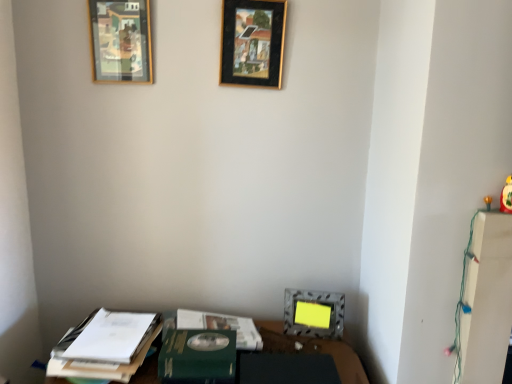
Image resolution: width=512 pixels, height=384 pixels. I want to click on yellow matte toy at right, so click(506, 196).

From the picture: What is the approximate height of metallic silver picture frame at lower center, acting as the 1th picture frame starting from the right?

7.00 inches.

Describe the element at coordinates (313, 313) in the screenshot. Image resolution: width=512 pixels, height=384 pixels. I see `metallic silver picture frame at lower center, positioned as the 3th picture frame in left-to-right order` at that location.

This screenshot has width=512, height=384. I want to click on yellow matte toy at right, so click(506, 196).

Considering the relative sizes of yellow matte toy at right and wooden frame at upper left, the first picture frame viewed from the top, in the image provided, is yellow matte toy at right thinner than wooden frame at upper left, the first picture frame viewed from the top,?

Incorrect, the width of yellow matte toy at right is not less than that of wooden frame at upper left, the first picture frame viewed from the top.

Is yellow matte toy at right to the left or to the right of wooden frame at upper left, which is the third picture frame from right to left, in the image?

yellow matte toy at right is positioned on wooden frame at upper left, which is the third picture frame from right to left,'s right side.

Can you see yellow matte toy at right touching wooden frame at upper left, the first picture frame viewed from the top?

There is a gap between yellow matte toy at right and wooden frame at upper left, the first picture frame viewed from the top.

From a real-world perspective, is yellow matte toy at right on top of wooden frame at upper left, which is the third picture frame from right to left?

No, from a real-world perspective, yellow matte toy at right is not on top of wooden frame at upper left, which is the third picture frame from right to left.

Is wooden frame at upper left, the 3th picture frame in the bottom-to-top sequence, inside the boundaries of green matte paperback book at lower center, or outside?

wooden frame at upper left, the 3th picture frame in the bottom-to-top sequence, is located beyond the bounds of green matte paperback book at lower center.

Looking at this image, in terms of width, does wooden frame at upper left, the first picture frame viewed from the top, look wider or thinner when compared to green matte paperback book at lower center?

Considering their sizes, wooden frame at upper left, the first picture frame viewed from the top, looks slimmer than green matte paperback book at lower center.

From the image's perspective, which object appears higher, wooden frame at upper left, which is the third picture frame from right to left, or green matte paperback book at lower center?

wooden frame at upper left, which is the third picture frame from right to left, appears higher in the image.

From the image's perspective, which one is positioned higher, black matte picture frame at upper center, which is the 2th picture frame in top-to-bottom order, or green matte journal at lower center?

black matte picture frame at upper center, which is the 2th picture frame in top-to-bottom order, from the image's perspective.

Is black matte picture frame at upper center, the second picture frame in the bottom-to-top sequence, facing towards green matte journal at lower center?

No, black matte picture frame at upper center, the second picture frame in the bottom-to-top sequence, is not aimed at green matte journal at lower center.

From a real-world perspective, is black matte picture frame at upper center, the second picture frame in the bottom-to-top sequence, positioned over green matte journal at lower center based on gravity?

Indeed, from a real-world perspective, black matte picture frame at upper center, the second picture frame in the bottom-to-top sequence, stands above green matte journal at lower center.

Locate an element on the screen. picture frame that is the 1st one when counting rightward from the green matte journal at lower center is located at coordinates (252, 42).

Which point is more distant from viewer, [316,328] or [261,11]?

The point [316,328] is more distant.

Are metallic silver picture frame at lower center, acting as the first picture frame starting from the bottom, and black matte picture frame at upper center, which is the 2th picture frame in top-to-bottom order, located far from each other?

No, there isn't a large distance between metallic silver picture frame at lower center, acting as the first picture frame starting from the bottom, and black matte picture frame at upper center, which is the 2th picture frame in top-to-bottom order.

From the image's perspective, does metallic silver picture frame at lower center, acting as the first picture frame starting from the bottom, appear lower than black matte picture frame at upper center, which is the 2th picture frame in top-to-bottom order?

Indeed, from the image's perspective, metallic silver picture frame at lower center, acting as the first picture frame starting from the bottom, is shown beneath black matte picture frame at upper center, which is the 2th picture frame in top-to-bottom order.

Do you think metallic silver picture frame at lower center, acting as the 1th picture frame starting from the right, is within black matte picture frame at upper center, which is the 2th picture frame in top-to-bottom order, or outside of it?

metallic silver picture frame at lower center, acting as the 1th picture frame starting from the right, lies outside black matte picture frame at upper center, which is the 2th picture frame in top-to-bottom order.

Which of these two, green matte journal at lower center or black matte picture frame at upper center, the 2th picture frame in the left-to-right sequence, is smaller?

black matte picture frame at upper center, the 2th picture frame in the left-to-right sequence, is smaller.

Does green matte journal at lower center turn towards black matte picture frame at upper center, arranged as the second picture frame when viewed from the right?

No.

Between green matte journal at lower center and black matte picture frame at upper center, arranged as the second picture frame when viewed from the right, which one has larger width?

green matte journal at lower center is wider.

From a real-world perspective, is green matte journal at lower center positioned above or below black matte picture frame at upper center, arranged as the second picture frame when viewed from the right?

green matte journal at lower center is below black matte picture frame at upper center, arranged as the second picture frame when viewed from the right.

In terms of width, does black matte picture frame at upper center, the second picture frame in the bottom-to-top sequence, look wider or thinner when compared to green matte paperback book at lower center?

Clearly, black matte picture frame at upper center, the second picture frame in the bottom-to-top sequence, has less width compared to green matte paperback book at lower center.

Which is in front, point (228, 57) or point (169, 362)?

Point (169, 362)

Looking at this image, could you tell me if black matte picture frame at upper center, the 2th picture frame in the left-to-right sequence, is turned towards green matte paperback book at lower center?

No, black matte picture frame at upper center, the 2th picture frame in the left-to-right sequence, is not oriented towards green matte paperback book at lower center.

Could you measure the distance between metallic silver picture frame at lower center, acting as the 1th picture frame starting from the right, and wooden frame at upper left, the first picture frame viewed from the top?

metallic silver picture frame at lower center, acting as the 1th picture frame starting from the right, is 1.13 meters from wooden frame at upper left, the first picture frame viewed from the top.

Is metallic silver picture frame at lower center, the 3th picture frame from the top, oriented towards wooden frame at upper left, the 3th picture frame in the bottom-to-top sequence?

No.

Is wooden frame at upper left, which is the first picture frame in left-to-right order, a part of metallic silver picture frame at lower center, acting as the 1th picture frame starting from the right?

That's incorrect, wooden frame at upper left, which is the first picture frame in left-to-right order, is not inside metallic silver picture frame at lower center, acting as the 1th picture frame starting from the right.

Between metallic silver picture frame at lower center, acting as the 1th picture frame starting from the right, and wooden frame at upper left, the first picture frame viewed from the top, which one has larger width?

metallic silver picture frame at lower center, acting as the 1th picture frame starting from the right.

What are the coordinates of `the 2nd picture frame above the yellow matte toy at right (from the image's perspective)` in the screenshot? It's located at (120, 41).

Locate an element on the screen. paperback book on the right of the wooden frame at upper left, which is the first picture frame in left-to-right order is located at coordinates (198, 357).

Looking at the image, which one is located closer to metallic silver picture frame at lower center, acting as the first picture frame starting from the bottom, black matte picture frame at upper center, the 2th picture frame in the left-to-right sequence, or green matte paperback book at lower center?

green matte paperback book at lower center is closer to metallic silver picture frame at lower center, acting as the first picture frame starting from the bottom.

Which object lies further to the anchor point green matte paperback book at lower center, metallic silver picture frame at lower center, the 3th picture frame from the top, or green matte journal at lower center?

The object further to green matte paperback book at lower center is metallic silver picture frame at lower center, the 3th picture frame from the top.

From the image, which object appears to be farther from green matte journal at lower center, metallic silver picture frame at lower center, positioned as the 3th picture frame in left-to-right order, or black matte picture frame at upper center, arranged as the second picture frame when viewed from the right?

black matte picture frame at upper center, arranged as the second picture frame when viewed from the right.

Looking at the image, which one is located closer to wooden frame at upper left, the 3th picture frame in the bottom-to-top sequence, black matte picture frame at upper center, the second picture frame in the bottom-to-top sequence, or green matte paperback book at lower center?

The object closer to wooden frame at upper left, the 3th picture frame in the bottom-to-top sequence, is black matte picture frame at upper center, the second picture frame in the bottom-to-top sequence.

Based on the photo, estimate the real-world distances between objects in this image. Which object is further from yellow matte toy at right, wooden frame at upper left, the first picture frame viewed from the top, or black matte picture frame at upper center, arranged as the second picture frame when viewed from the right?

wooden frame at upper left, the first picture frame viewed from the top.

Which object lies further to the anchor point green matte journal at lower center, wooden frame at upper left, which is the third picture frame from right to left, or yellow matte toy at right?

wooden frame at upper left, which is the third picture frame from right to left, is positioned further to the anchor green matte journal at lower center.

Which object lies nearer to the anchor point wooden frame at upper left, the 3th picture frame in the bottom-to-top sequence, yellow matte toy at right or metallic silver picture frame at lower center, the 3th picture frame from the top?

The object closer to wooden frame at upper left, the 3th picture frame in the bottom-to-top sequence, is metallic silver picture frame at lower center, the 3th picture frame from the top.

Which object lies further to the anchor point wooden frame at upper left, the first picture frame viewed from the top, metallic silver picture frame at lower center, acting as the first picture frame starting from the bottom, or yellow matte toy at right?

Based on the image, yellow matte toy at right appears to be further to wooden frame at upper left, the first picture frame viewed from the top.

Locate an element on the screen. The image size is (512, 384). toy between black matte picture frame at upper center, the second picture frame in the bottom-to-top sequence, and metallic silver picture frame at lower center, positioned as the 3th picture frame in left-to-right order, in the vertical direction is located at coordinates (506, 196).

You are a GUI agent. You are given a task and a screenshot of the screen. Output one action in this format:
    pyautogui.click(x=<x>, y=<y>)
    Task: Click on the toy between black matte picture frame at upper center, the second picture frame in the bottom-to-top sequence, and green matte journal at lower center from top to bottom
    Image resolution: width=512 pixels, height=384 pixels.
    Given the screenshot: What is the action you would take?
    click(x=506, y=196)

Locate an element on the screen. The width and height of the screenshot is (512, 384). picture frame between wooden frame at upper left, the first picture frame viewed from the top, and metallic silver picture frame at lower center, the 3th picture frame from the top, in the vertical direction is located at coordinates (252, 42).

Find the location of `journal located between green matte paperback book at lower center and metallic silver picture frame at lower center, positioned as the 3th picture frame in left-to-right order, in the left-right direction`. journal located between green matte paperback book at lower center and metallic silver picture frame at lower center, positioned as the 3th picture frame in left-to-right order, in the left-right direction is located at coordinates (221, 326).